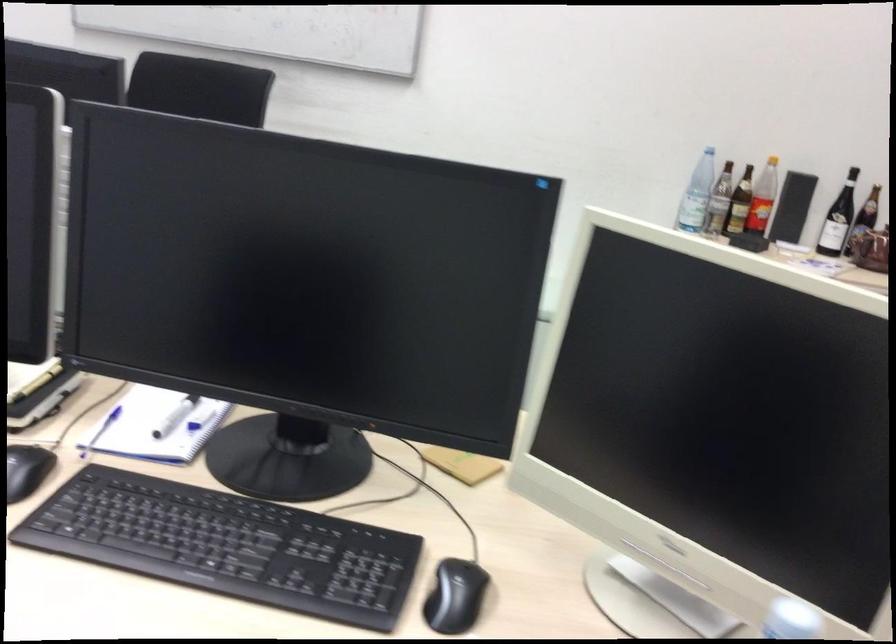
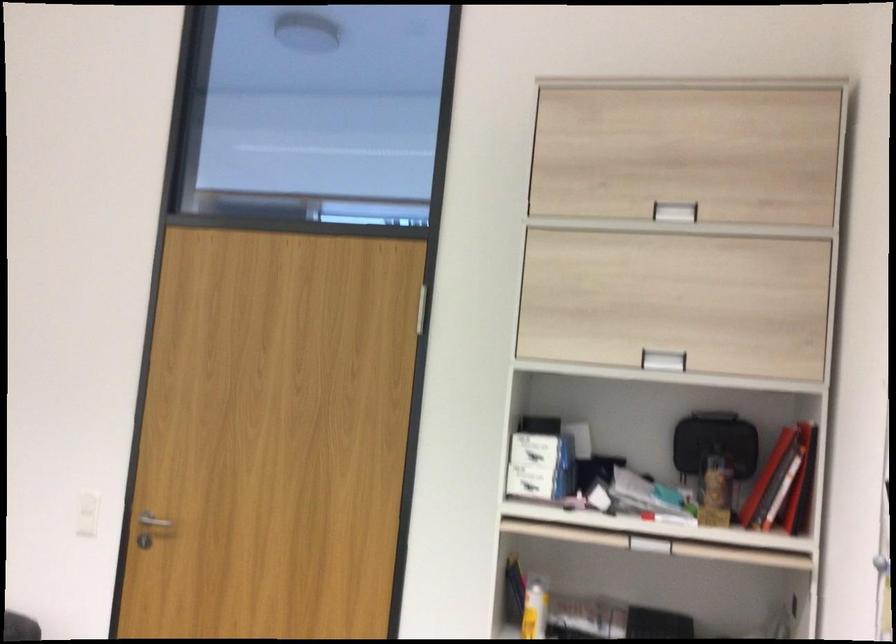
Question: The camera is either moving clockwise (left) or counter-clockwise (right) around the object. The first image is from the beginning of the video and the second image is from the end. Is the camera moving left or right when shooting the video?

Choices:
 (A) Left
 (B) Right

Answer: (A)